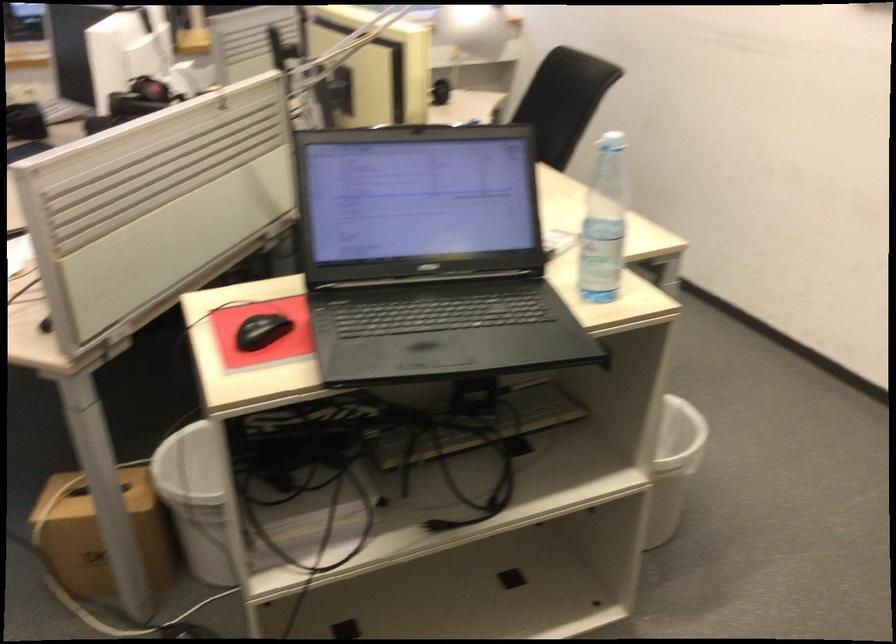
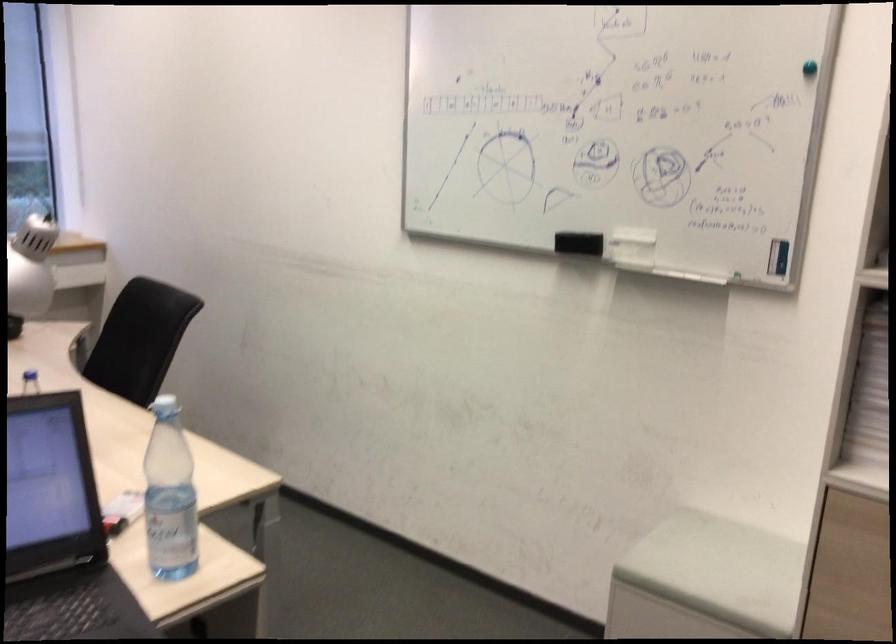
Question: Based on the continuous images, in which direction is the camera rotating? Reply with the corresponding letter.

Choices:
 (A) Left
 (B) Right
 (C) Up
 (D) Down

Answer: (B)